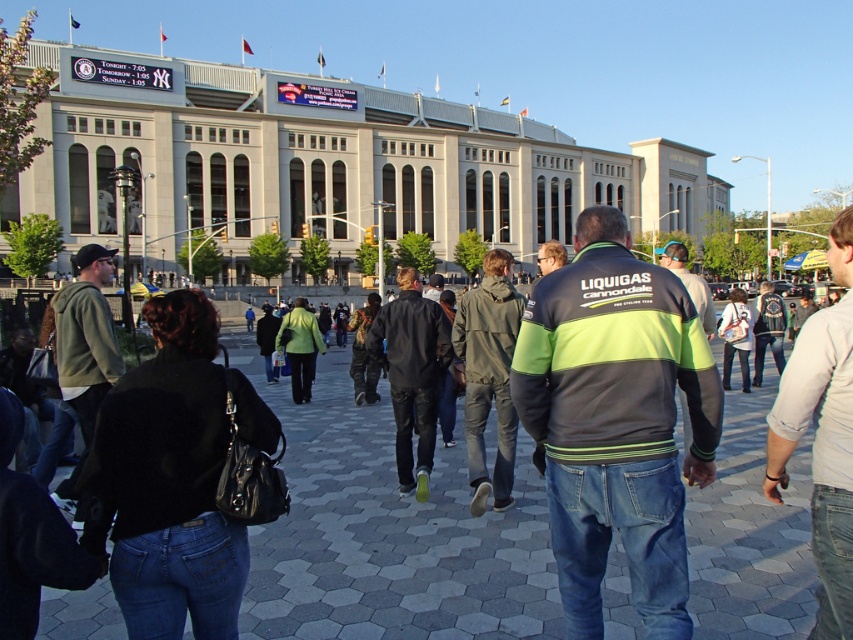
Can you confirm if white cotton shirt at right is positioned below black leather jacket at center?

Correct, white cotton shirt at right is located below black leather jacket at center.

Is point (822, 580) positioned behind point (393, 397)?

That is False.

Image resolution: width=853 pixels, height=640 pixels. In order to click on white cotton shirt at right in this screenshot , I will do point(822,436).

Who is shorter, green fleece jacket at left or green reflective jacket at center?

Standing shorter between the two is green fleece jacket at left.

Which is in front, point (100, 259) or point (666, 262)?

Point (100, 259)

Where is `green fleece jacket at left`? green fleece jacket at left is located at coordinates (84, 353).

Is green and gray jacket at center above black leather jacket at center?

Yes, green and gray jacket at center is above black leather jacket at center.

Is green and gray jacket at center below black leather jacket at center?

Incorrect, green and gray jacket at center is not positioned below black leather jacket at center.

I want to click on green and gray jacket at center, so click(616, 420).